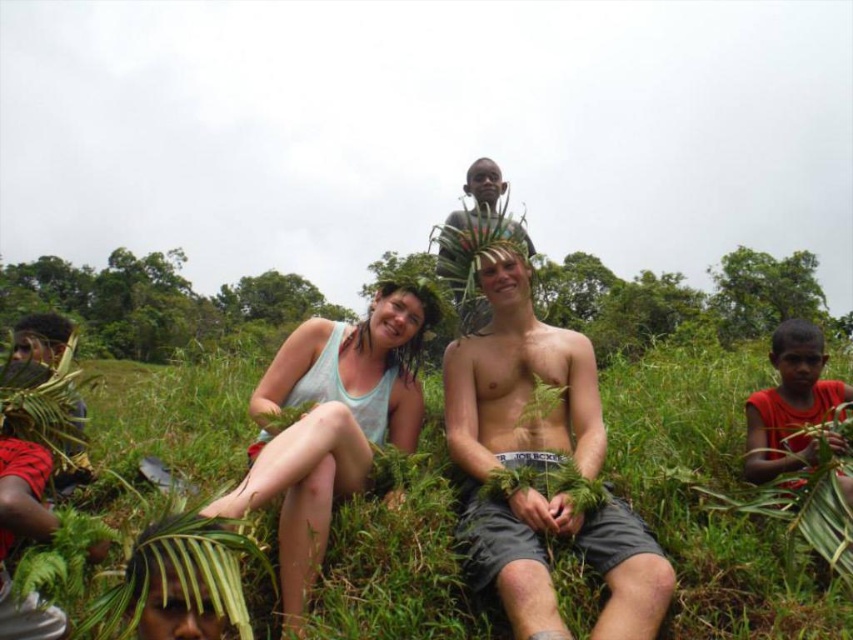
Question: Is green leafy grass at center below smooth brown leaflet at upper center?

Choices:
 (A) no
 (B) yes

Answer: (B)

Question: Which point is closer to the camera taking this photo?

Choices:
 (A) (534, 545)
 (B) (474, 227)

Answer: (A)

Question: In this image, where is smooth skin man at center located relative to white tank top at center?

Choices:
 (A) left
 (B) right

Answer: (B)

Question: Is green leafy grass at center positioned before red fabric shirt at lower right?

Choices:
 (A) no
 (B) yes

Answer: (B)

Question: Among these points, which one is nearest to the camera?

Choices:
 (A) (91, 435)
 (B) (486, 184)
 (C) (393, 413)

Answer: (C)

Question: Which of the following is the closest to the observer?

Choices:
 (A) (444, 237)
 (B) (332, 432)

Answer: (B)